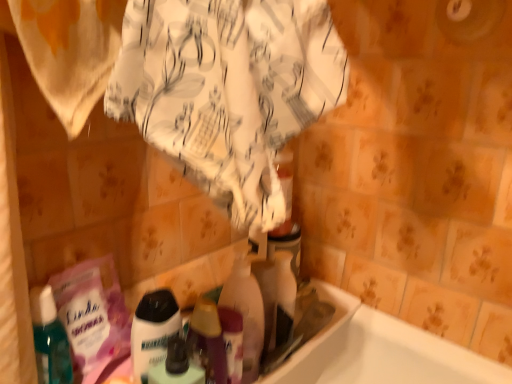
Question: Is translucent plastic bottle at center, which is the 3th cleaning product in right-to-left order, wider or thinner than translucent plastic bottle at center, which is counted as the second cleaning product, starting from the left?

Choices:
 (A) thin
 (B) wide

Answer: (A)

Question: Is translucent plastic bottle at center, which is the 3th cleaning product in right-to-left order, in front of or behind translucent plastic bottle at center, arranged as the second cleaning product when viewed from the right, in the image?

Choices:
 (A) front
 (B) behind

Answer: (A)

Question: Considering the real-world distances, which object is farthest from the translucent plastic bottle at center, arranged as the second cleaning product when viewed from the right?

Choices:
 (A) translucent plastic bottle at center, which is the 3th cleaning product in right-to-left order
 (B) translucent plastic bottle at center, the 1th cleaning product positioned from the right

Answer: (A)

Question: Considering the real-world distances, which object is farthest from the translucent plastic bottle at center, arranged as the second cleaning product when viewed from the right?

Choices:
 (A) translucent plastic bottle at center, the third cleaning product viewed from the left
 (B) translucent plastic bottle at center, which is the 3th cleaning product in right-to-left order

Answer: (B)